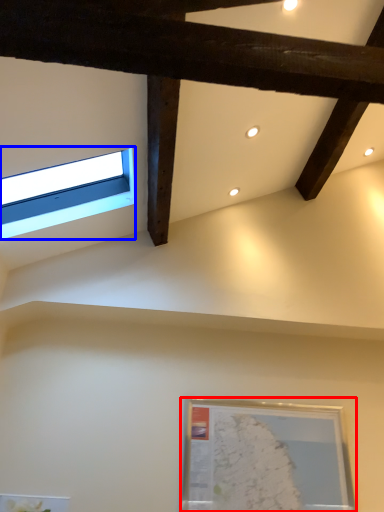
Question: Which object appears farthest to the camera in this image, picture frame (highlighted by a red box) or window (highlighted by a blue box)?

Choices:
 (A) picture frame
 (B) window

Answer: (A)